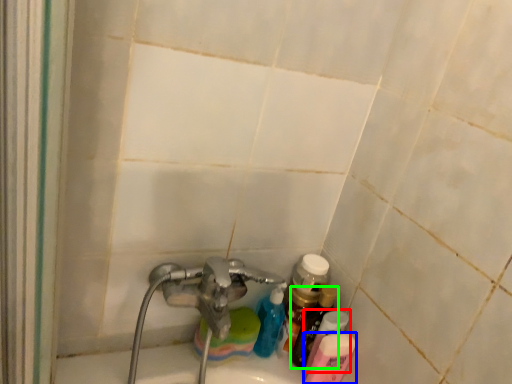
Question: Which is nearer to the toiletry (highlighted by a red box)? toiletry (highlighted by a blue box) or bottle (highlighted by a green box).

Choices:
 (A) toiletry
 (B) bottle

Answer: (A)